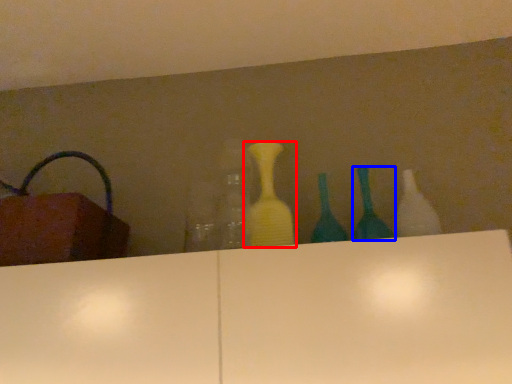
Question: Which object is closer to the camera taking this photo, bottle (highlighted by a red box) or bottle (highlighted by a blue box)?

Choices:
 (A) bottle
 (B) bottle

Answer: (B)